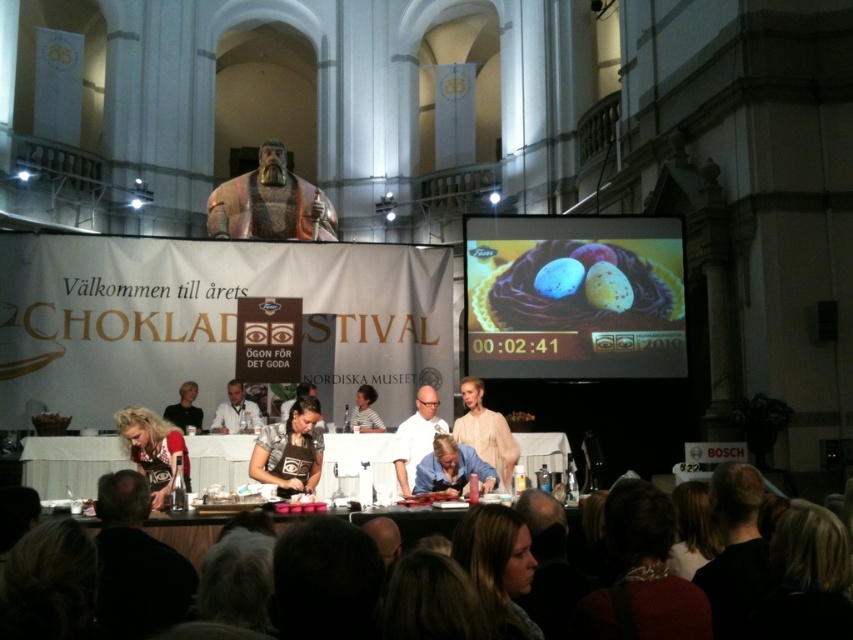
Does white shirt at center appear over smooth beige shirt at center?

Correct, white shirt at center is located above smooth beige shirt at center.

Is point (213, 419) farther from viewer compared to point (352, 413)?

No.

Measure the distance between point [222,429] and camera.

They are 46.17 meters apart.

Locate an element on the screen. white shirt at center is located at coordinates (235, 412).

Who is positioned more to the left, white glossy table at center or white glossy chef coat at center?

white glossy table at center is more to the left.

Is point (196, 445) farther from viewer compared to point (403, 429)?

No, it is in front of (403, 429).

Who is more distant from viewer, (70, 477) or (418, 452)?

The point (418, 452) is more distant.

The image size is (853, 640). Identify the location of white glossy table at center. (68, 464).

How distant is blonde hair at lower left from blue fabric shirt at center?

A distance of 11.57 meters exists between blonde hair at lower left and blue fabric shirt at center.

Who is shorter, blonde hair at lower left or blue fabric shirt at center?

Standing shorter between the two is blue fabric shirt at center.

Measure the distance between blonde hair at lower left and camera.

blonde hair at lower left and camera are 32.64 meters apart.

Where is `blonde hair at lower left`? The width and height of the screenshot is (853, 640). blonde hair at lower left is located at coordinates (154, 449).